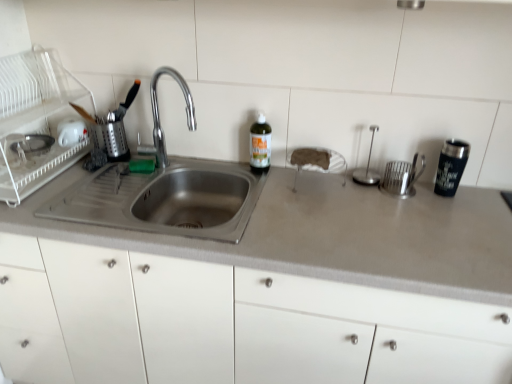
What are the coordinates of `unoccupied area in front of white glossy mug at upper left, the 2th appliance viewed from the left` in the screenshot? It's located at (66, 175).